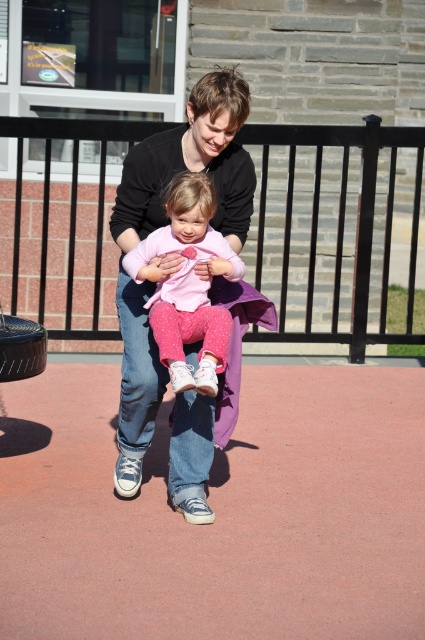
You are a painter standing at the edge of the scene. You want to paint both the black metal fence at upper center and the matte black shirt at center. Which object should you focus on first if you want to paint the smaller one first?

The black metal fence at upper center should be painted first because it has a smaller size compared to the matte black shirt at center.

You are a photographer positioned at the edge of the paved area. You want to capture a photo where the matte black shirt at center and the pink polka dot pants at center are both visible. Based on their positions, which object should be placed on the left side of the photo frame?

The matte black shirt at center is to the left of the pink polka dot pants at center, so the matte black shirt at center should be placed on the left side of the photo frame.

You are a maintenance worker checking the distance between the black metal fence at upper center and the matte black shirt at center. According to safety regulations, the minimum distance between playground equipment and fences should be 3 meters. Is the current distance compliant with the safety standards?

The black metal fence at upper center and matte black shirt at center are 2.95 meters apart, which is slightly less than the required 3 meters. Therefore, the current distance does not comply with the safety standards.